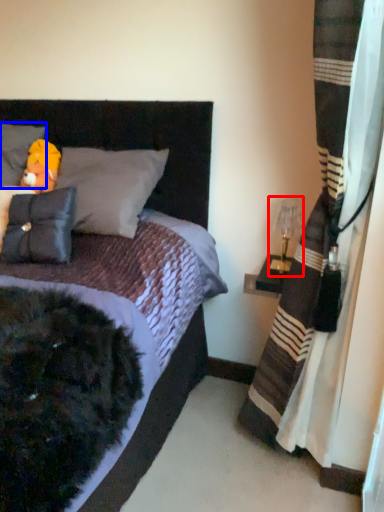
Question: Among these objects, which one is nearest to the camera, table lamp (highlighted by a red box) or pillow (highlighted by a blue box)?

Choices:
 (A) table lamp
 (B) pillow

Answer: (A)